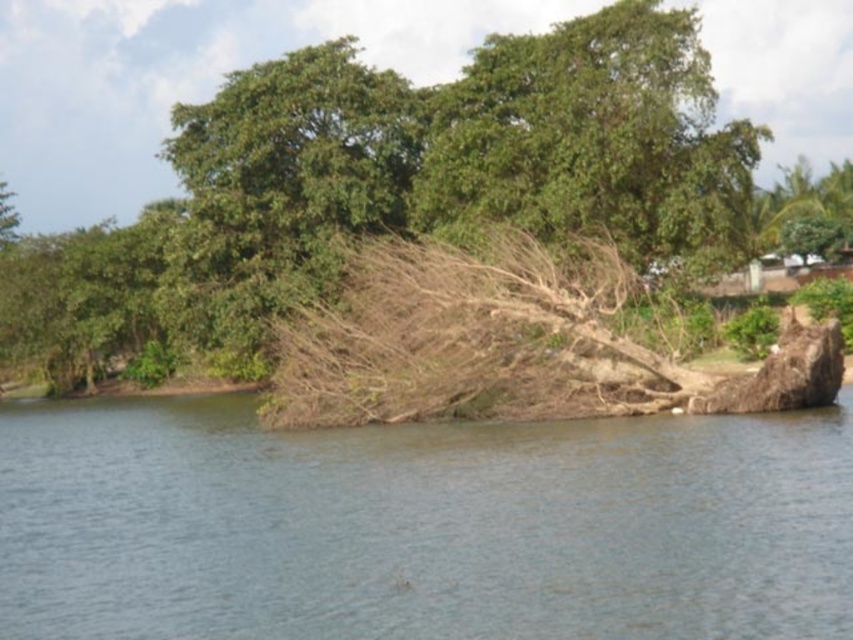
Question: Can you confirm if green leafy tree at upper center is thinner than green leafy tree at upper left?

Choices:
 (A) no
 (B) yes

Answer: (B)

Question: Which point appears farthest from the camera in this image?

Choices:
 (A) (786, 205)
 (B) (596, 433)
 (C) (79, 324)
 (D) (515, 202)

Answer: (A)

Question: Can you confirm if green leafy tree at upper left is positioned above green leafy tree at upper right?

Choices:
 (A) yes
 (B) no

Answer: (B)

Question: Which object is farther from the camera taking this photo?

Choices:
 (A) green leafy tree at upper center
 (B) brown/dry wood tree at center
 (C) green leafy tree at upper left
 (D) brown dirt at center

Answer: (C)

Question: Which point appears farthest from the camera in this image?

Choices:
 (A) (836, 176)
 (B) (621, 122)

Answer: (A)

Question: Can you confirm if brown/dry wood tree at center is thinner than green leafy tree at upper center?

Choices:
 (A) no
 (B) yes

Answer: (A)